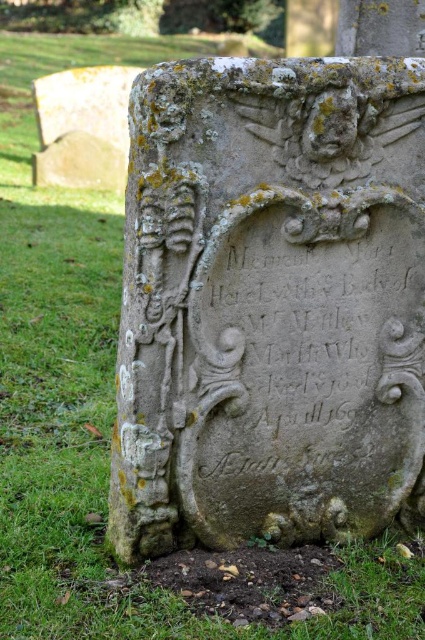
You are a historian examining the carved stone gravestone at center and the carved stone inscription at center. Which object has a greater width?

The carved stone gravestone at center has a greater width than the carved stone inscription at center.

You are standing in a cemetery and see a point marked at coordinates (269, 301). Based on the image description, what object is located at that point?

The point at coordinates (269, 301) marks the carved stone gravestone at center.